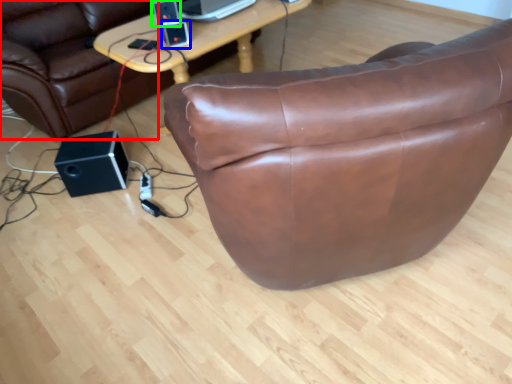
Question: Estimate the real-world distances between objects in this image. Which object is farther from bean bag chair (highlighted by a red box), ipod (highlighted by a blue box) or speaker (highlighted by a green box)?

Choices:
 (A) ipod
 (B) speaker

Answer: (A)